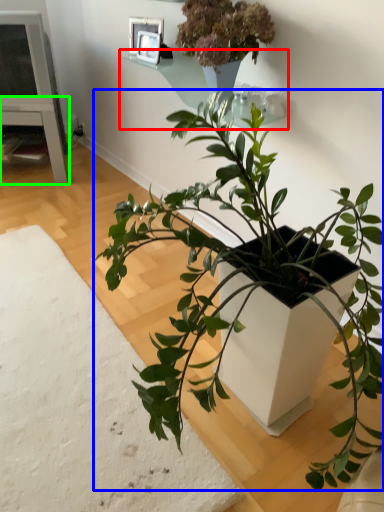
Question: Which is nearer to the window sill (highlighted by a red box)? houseplant (highlighted by a blue box) or table (highlighted by a green box).

Choices:
 (A) houseplant
 (B) table

Answer: (A)